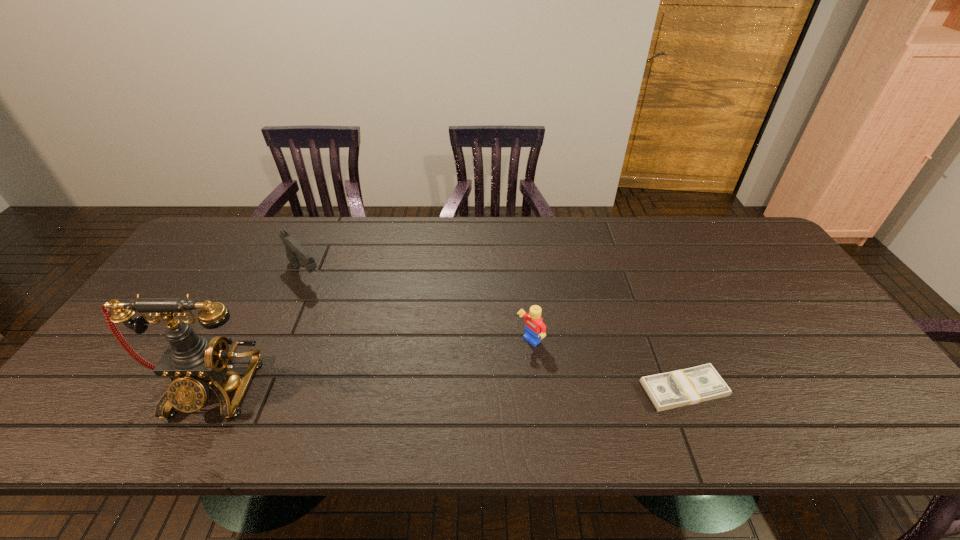
Identify the location of empty location between the second object from right to left and the pistol. The height and width of the screenshot is (540, 960). pyautogui.click(x=418, y=308).

Where is `vacant space that's between the farthest object and the second object from right to left`? vacant space that's between the farthest object and the second object from right to left is located at coordinates (418, 308).

What are the coordinates of `the third closest object to the second farthest object` in the screenshot? It's located at (193, 362).

Point out which object is positioned as the third nearest to the telephone. Please provide its 2D coordinates. Your answer should be formatted as a tuple, i.e. [(x, y)], where the tuple contains the x and y coordinates of a point satisfying the conditions above.

[(689, 386)]

Where is `free spot that satisfies the following two spatial constraints: 1. on the front of the tallest object, featuring the rotary dial; 2. on the right side of the rightmost object`? free spot that satisfies the following two spatial constraints: 1. on the front of the tallest object, featuring the rotary dial; 2. on the right side of the rightmost object is located at coordinates (211, 389).

Find the location of a particular element. The width and height of the screenshot is (960, 540). vacant space that satisfies the following two spatial constraints: 1. on the front side of the second farthest object; 2. on the right side of the shortest object is located at coordinates (535, 389).

Where is `free location that satisfies the following two spatial constraints: 1. on the front of the dollar, featuring the rotary dial; 2. on the right side of the tallest object`? free location that satisfies the following two spatial constraints: 1. on the front of the dollar, featuring the rotary dial; 2. on the right side of the tallest object is located at coordinates (211, 389).

Identify the location of vacant area in the image that satisfies the following two spatial constraints: 1. on the front of the dollar, featuring the rotary dial; 2. on the left side of the telephone. The width and height of the screenshot is (960, 540). (211, 389).

Find the location of a particular element. This screenshot has height=540, width=960. free point that satisfies the following two spatial constraints: 1. on the front of the shortest object, featuring the rotary dial; 2. on the right side of the tallest object is located at coordinates (211, 389).